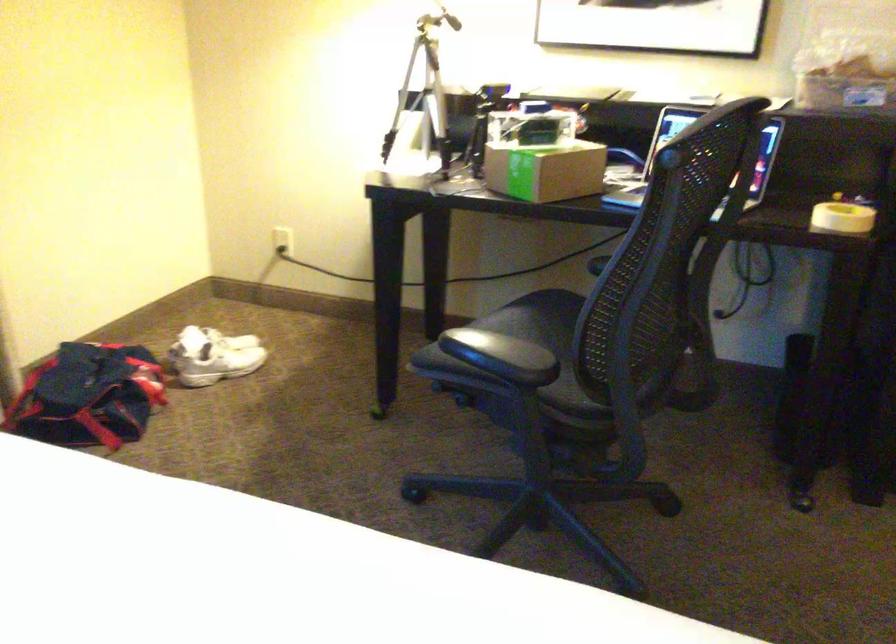
This screenshot has height=644, width=896. I want to click on black chair armrest, so click(x=501, y=355).